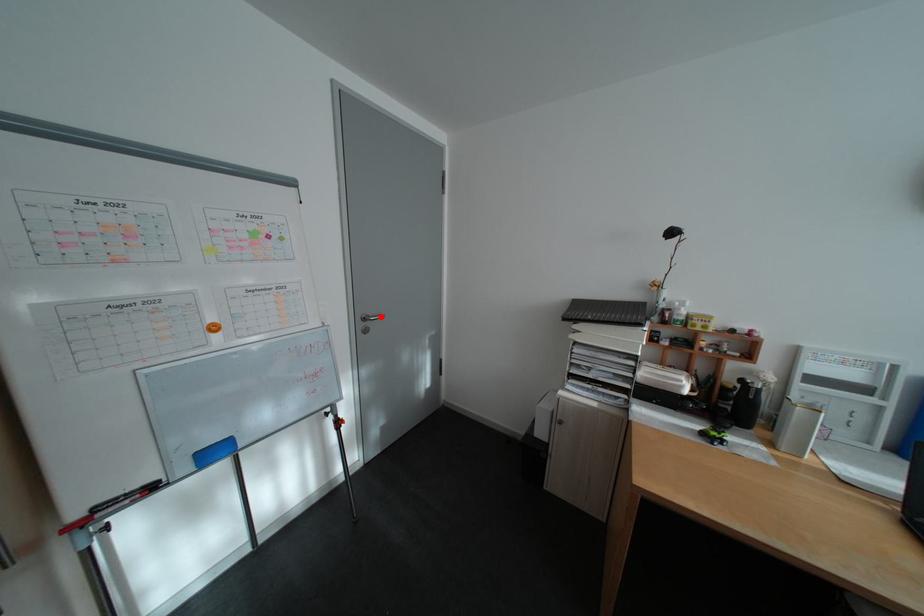
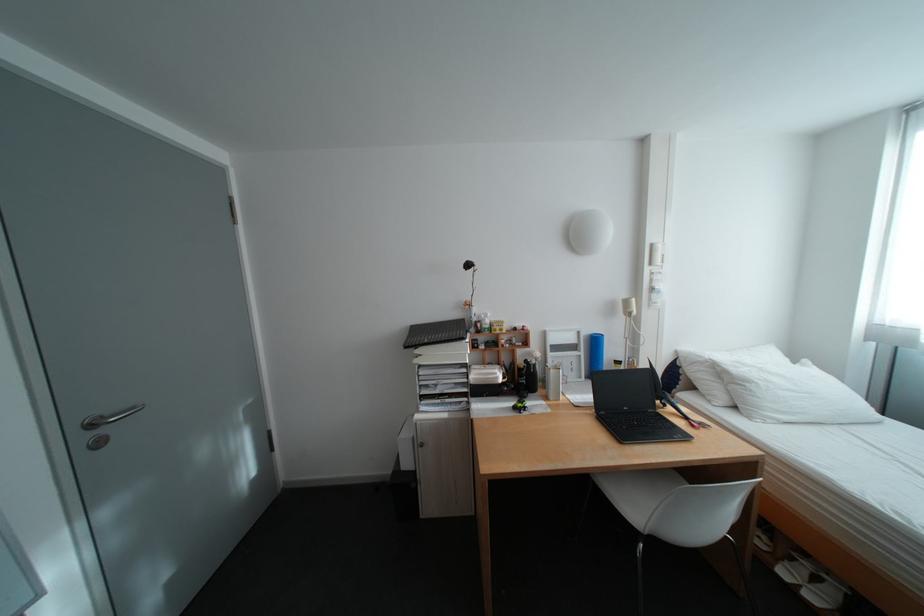
Find the pixel in the second image that matches the highlighted location in the first image.

(115, 418)